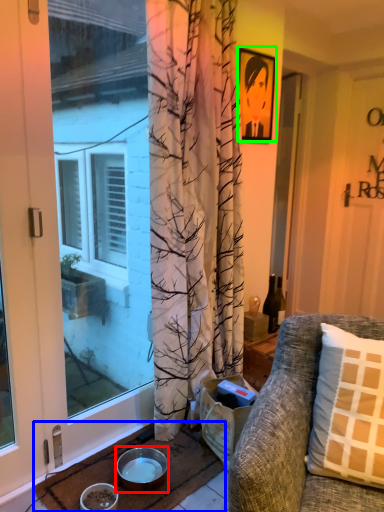
Question: Which object is the closest to the bowl (highlighted by a red box)? Choose among these: doormat (highlighted by a blue box) or picture frame (highlighted by a green box).

Choices:
 (A) doormat
 (B) picture frame

Answer: (A)